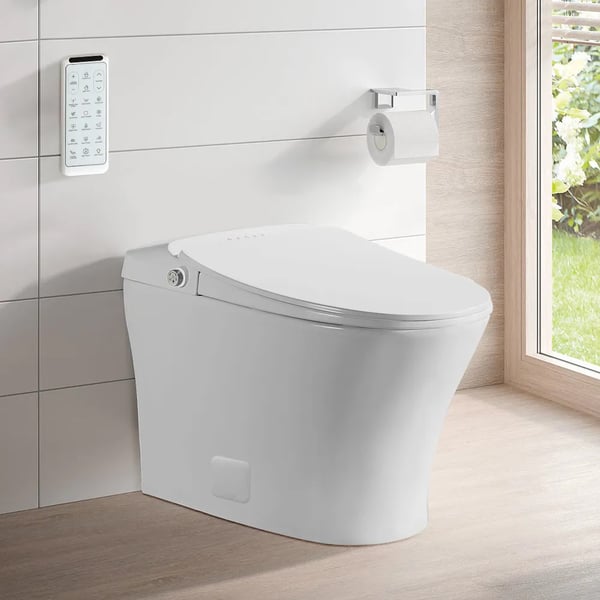
You are a GUI agent. You are given a task and a screenshot of the screen. Output one action in this format:
    pyautogui.click(x=<x>, y=<y>)
    Task: Click on the remote control
    
    Given the screenshot: What is the action you would take?
    pyautogui.click(x=90, y=103)